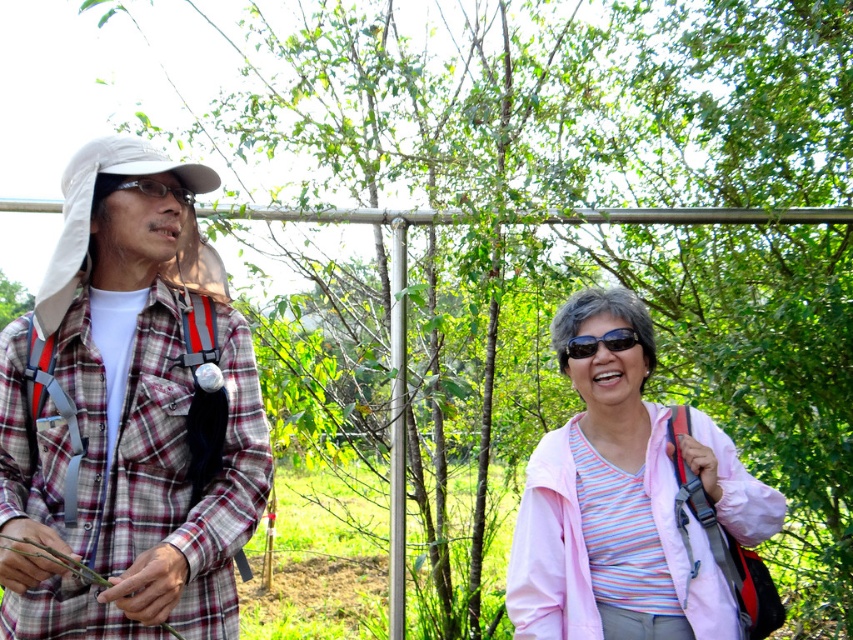
You are a photographer trying to capture a photo of the two people in the image. You want to ensure that the plaid fabric shirt at left and the white fabric baseball hat at left are both clearly visible in the frame. Based on their positions, which object should you focus on first to ensure both are in focus?

The white fabric baseball hat at left is to the left of the plaid fabric shirt at left, so focusing on the white fabric baseball hat at left first would ensure both objects are in focus since it is closer to the left edge of the frame.

From the picture: You are a photographer trying to capture a portrait of the person wearing the plaid fabric shirt at left and the white fabric baseball hat at left. To ensure both items are in focus, what is the minimum distance you should set your camera lens to?

The plaid fabric shirt at left and white fabric baseball hat at left are 9.79 inches apart. To ensure both are in focus, the minimum distance should be set so that the depth of field covers at least 9.79 inches between them.